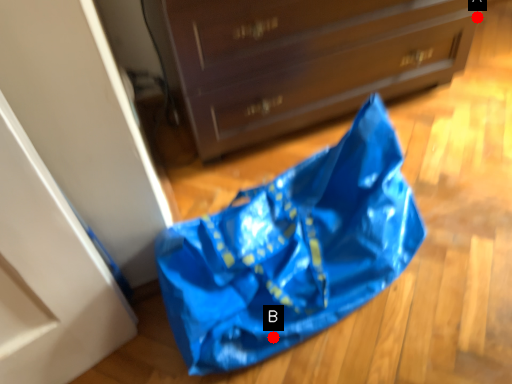
Question: Two points are circled on the image, labeled by A and B beside each circle. Which point is further to the camera?

Choices:
 (A) A is further
 (B) B is further

Answer: (A)